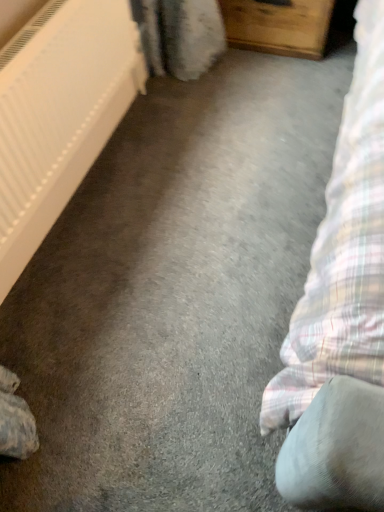
The width and height of the screenshot is (384, 512). Describe the element at coordinates (59, 113) in the screenshot. I see `white plastic radiator at left` at that location.

You are a GUI agent. You are given a task and a screenshot of the screen. Output one action in this format:
    pyautogui.click(x=<x>, y=<y>)
    Task: Click on the white plastic radiator at left
    
    Given the screenshot: What is the action you would take?
    59,113

Describe the element at coordinates (278, 26) in the screenshot. I see `wooden chest of drawers at upper center` at that location.

Locate an element on the screen. The width and height of the screenshot is (384, 512). wooden chest of drawers at upper center is located at coordinates (278, 26).

Identify the location of white plastic radiator at left. Image resolution: width=384 pixels, height=512 pixels. (x=59, y=113).

Considering the positions of objects white plastic radiator at left and wooden chest of drawers at upper center in the image provided, who is more to the right, white plastic radiator at left or wooden chest of drawers at upper center?

wooden chest of drawers at upper center.

Considering their positions, is white plastic radiator at left located in front of or behind wooden chest of drawers at upper center?

white plastic radiator at left is in front of wooden chest of drawers at upper center.

Between point (5, 82) and point (284, 21), which one is positioned in front?

The point (5, 82) is more forward.

From the image's perspective, is white plastic radiator at left located above or below wooden chest of drawers at upper center?

Based on their image positions, white plastic radiator at left is located beneath wooden chest of drawers at upper center.

Consider the image. From a real-world perspective, which object stands above the other?

white plastic radiator at left, from a real-world perspective.

Is white plastic radiator at left wider than wooden chest of drawers at upper center?

No, white plastic radiator at left is not wider than wooden chest of drawers at upper center.

Between white plastic radiator at left and wooden chest of drawers at upper center, which one has more height?

white plastic radiator at left is taller.

Who is smaller, white plastic radiator at left or wooden chest of drawers at upper center?

wooden chest of drawers at upper center is smaller.

Would you say white plastic radiator at left is outside wooden chest of drawers at upper center?

Indeed, white plastic radiator at left is completely outside wooden chest of drawers at upper center.

Is the surface of white plastic radiator at left in direct contact with wooden chest of drawers at upper center?

No, white plastic radiator at left is not making contact with wooden chest of drawers at upper center.

Is white plastic radiator at left positioned with its back to wooden chest of drawers at upper center?

white plastic radiator at left is not turned away from wooden chest of drawers at upper center.

Find the location of a particular element. Image resolution: width=384 pixels, height=512 pixels. radiator in front of the wooden chest of drawers at upper center is located at coordinates (59, 113).

Is wooden chest of drawers at upper center to the left or to the right of white plastic radiator at left in the image?

wooden chest of drawers at upper center is to the right of white plastic radiator at left.

Is the depth of wooden chest of drawers at upper center greater than that of white plastic radiator at left?

Yes, wooden chest of drawers at upper center is further from the camera.

Is point (239, 21) positioned after point (87, 96)?

Yes, point (239, 21) is farther from viewer.

From the image's perspective, who appears lower, wooden chest of drawers at upper center or white plastic radiator at left?

From the image's view, white plastic radiator at left is below.

From a real-world perspective, is wooden chest of drawers at upper center positioned over white plastic radiator at left based on gravity?

Actually, wooden chest of drawers at upper center is physically below white plastic radiator at left in the real world.

Can you confirm if wooden chest of drawers at upper center is wider than white plastic radiator at left?

Yes.

Between wooden chest of drawers at upper center and white plastic radiator at left, which one has less height?

wooden chest of drawers at upper center is shorter.

Which of these two, wooden chest of drawers at upper center or white plastic radiator at left, is bigger?

With larger size is white plastic radiator at left.

Choose the correct answer: Is wooden chest of drawers at upper center inside white plastic radiator at left or outside it?

wooden chest of drawers at upper center is located beyond the bounds of white plastic radiator at left.

Is wooden chest of drawers at upper center touching white plastic radiator at left?

No, wooden chest of drawers at upper center is not beside white plastic radiator at left.

Is wooden chest of drawers at upper center aimed at white plastic radiator at left?

Yes, wooden chest of drawers at upper center is facing white plastic radiator at left.

Measure the distance between wooden chest of drawers at upper center and white plastic radiator at left.

wooden chest of drawers at upper center is 34.04 inches away from white plastic radiator at left.

Image resolution: width=384 pixels, height=512 pixels. Identify the location of furniture that is behind the white plastic radiator at left. (278, 26).

This screenshot has width=384, height=512. In order to click on radiator on the left side of wooden chest of drawers at upper center in this screenshot , I will do `click(59, 113)`.

Identify the location of furniture that is on the right side of white plastic radiator at left. This screenshot has height=512, width=384. (278, 26).